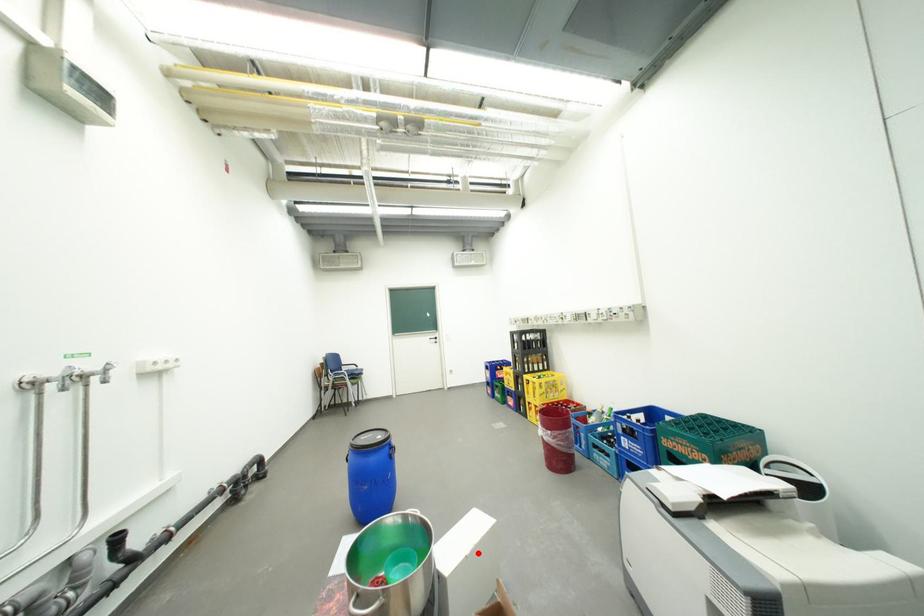
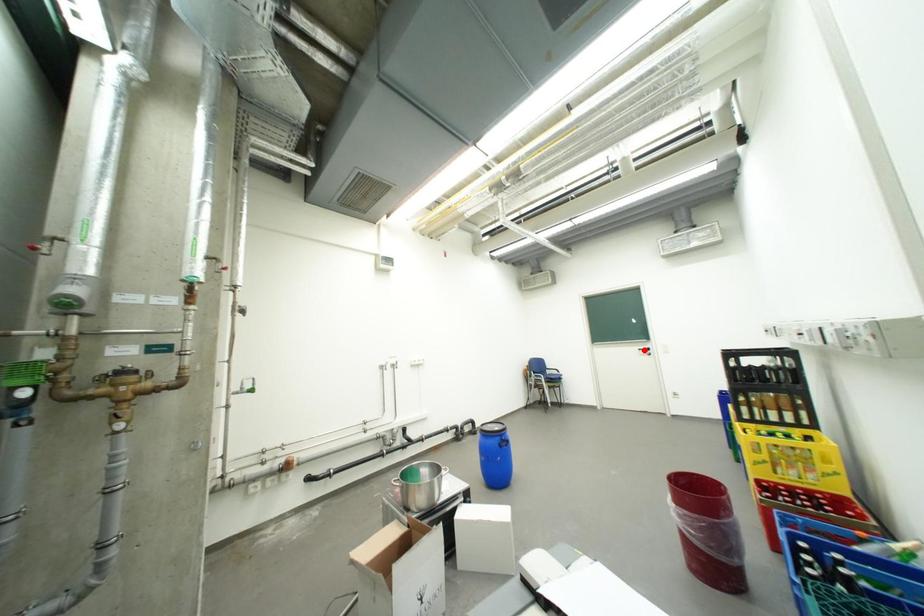
I am providing you with two images of the same scene from different viewpoints. A red point is marked on the first image and another point is marked on the second image. Is the marked point in image1 the same physical position as the marked point in image2?

No